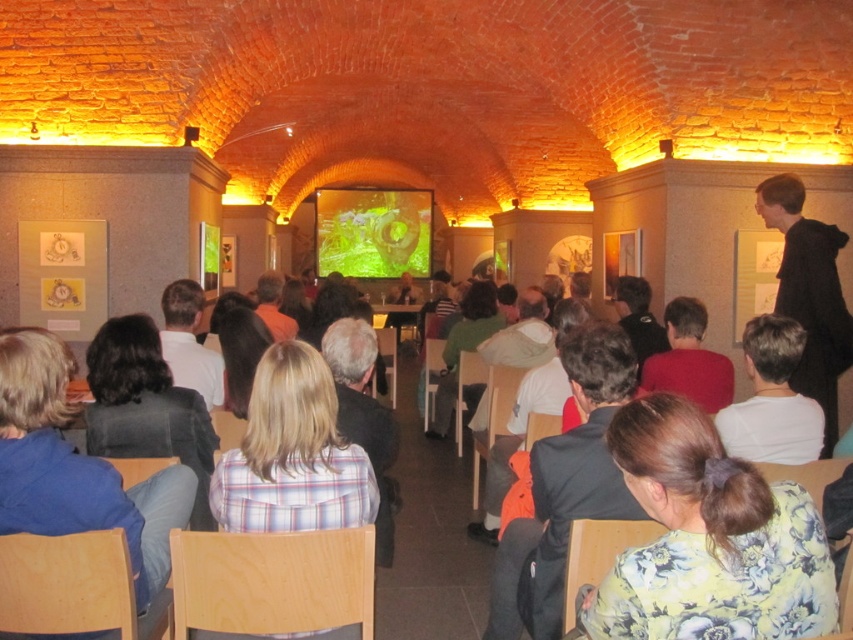
You are organizing a fire drill in this lecture hall and need to ensure everyone can exit safely. The emergency exit is located behind the black hoodie at right. If the average walking speed is 1.4 meters per second, how many seconds will it take for someone at the blonde hair at center to reach the exit?

The distance between the black hoodie at right and blonde hair at center is 8.42 meters. To reach the exit behind the black hoodie at right, the person at the blonde hair at center must cover this distance. At an average walking speed of 1.4 meters per second, the time required would be 8.42 divided by 1.4, which equals approximately 6.01 seconds. Therefore, it would take about 6 seconds.

You are organizing a photo shoot in this lecture hall and need to position a spotlight. The spotlight can only illuminate objects that are wider than 50 cm. Based on the scene, will the green fabric shirt at center and the blonde hair at center be illuminated by the spotlight?

The blonde hair at center is wider than the green fabric shirt at center. Since the spotlight requires objects wider than 50 cm, only the blonde hair at center will be illuminated.

You are organizing a lecture in this room and need to ensure that participants can hear the speaker clearly. The speaker is wearing a green fabric shirt at center. You have a microphone that has a range of 3 meters. Will the microphone placed at the blonde hair at center be able to pick up the speaker?

The distance between the green fabric shirt at center and the blonde hair at center is 4.05 meters. Since the microphone has a 3 meter range, it will not be able to pick up the speaker from that distance.